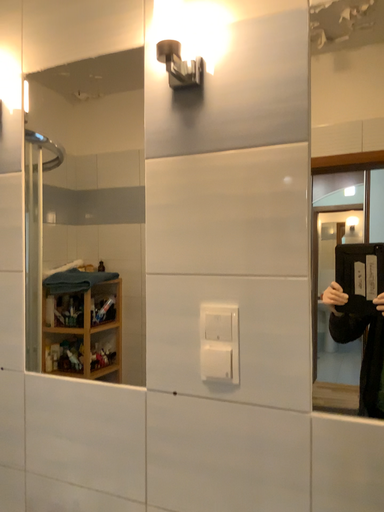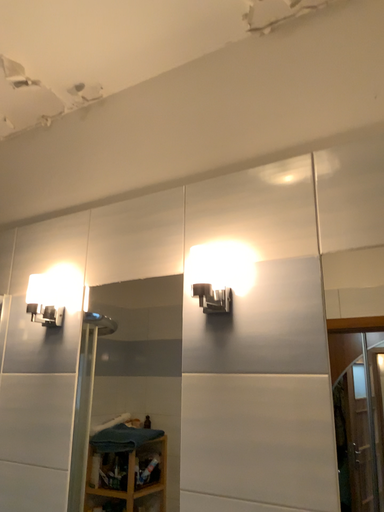
Question: How did the camera likely rotate when shooting the video?

Choices:
 (A) rotated left
 (B) rotated right

Answer: (A)